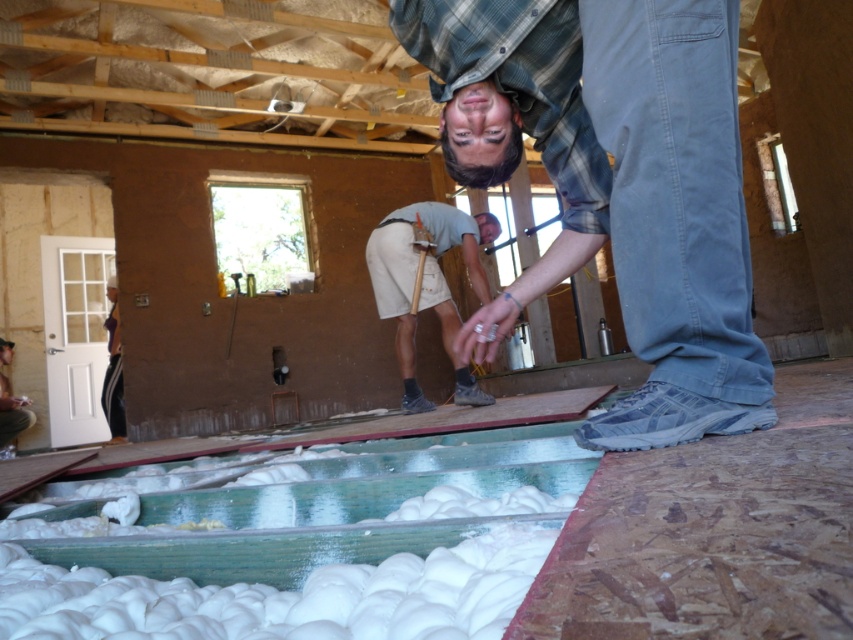
Question: Is black fabric at left thinner than wooden door at lower left?

Choices:
 (A) no
 (B) yes

Answer: (B)

Question: Which object appears closest to the camera in this image?

Choices:
 (A) blue jeans at center
 (B) light beige shorts at center
 (C) wooden door at lower left
 (D) black fabric at left

Answer: (A)

Question: Considering the real-world distances, which object is closest to the black fabric at left?

Choices:
 (A) blue jeans at center
 (B) light beige shorts at center
 (C) wooden door at lower left

Answer: (C)

Question: Considering the real-world distances, which object is closest to the blue jeans at center?

Choices:
 (A) light beige shorts at center
 (B) wooden door at lower left

Answer: (A)

Question: Observing the image, what is the correct spatial positioning of black fabric at left in reference to wooden door at lower left?

Choices:
 (A) left
 (B) right

Answer: (B)

Question: Is blue jeans at center smaller than light beige shorts at center?

Choices:
 (A) yes
 (B) no

Answer: (A)